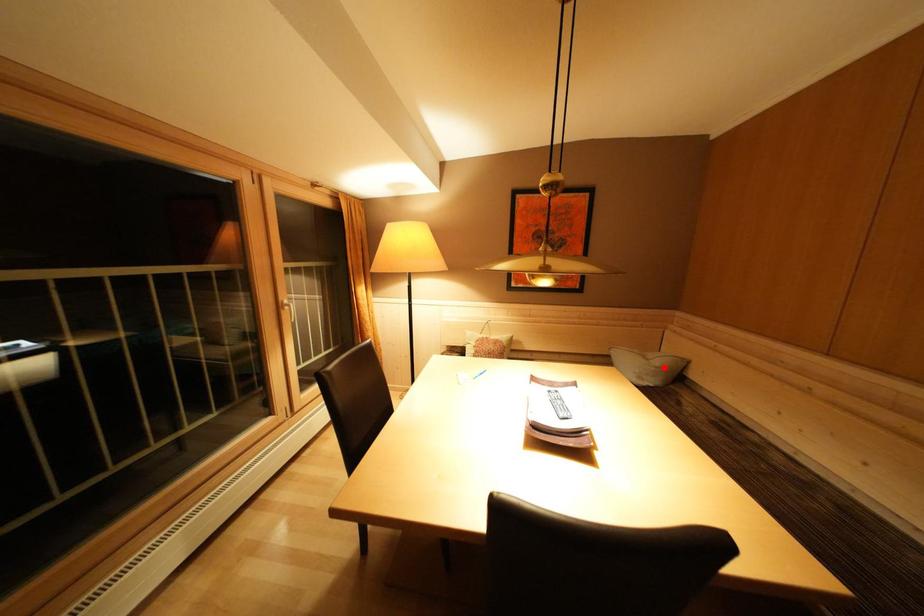
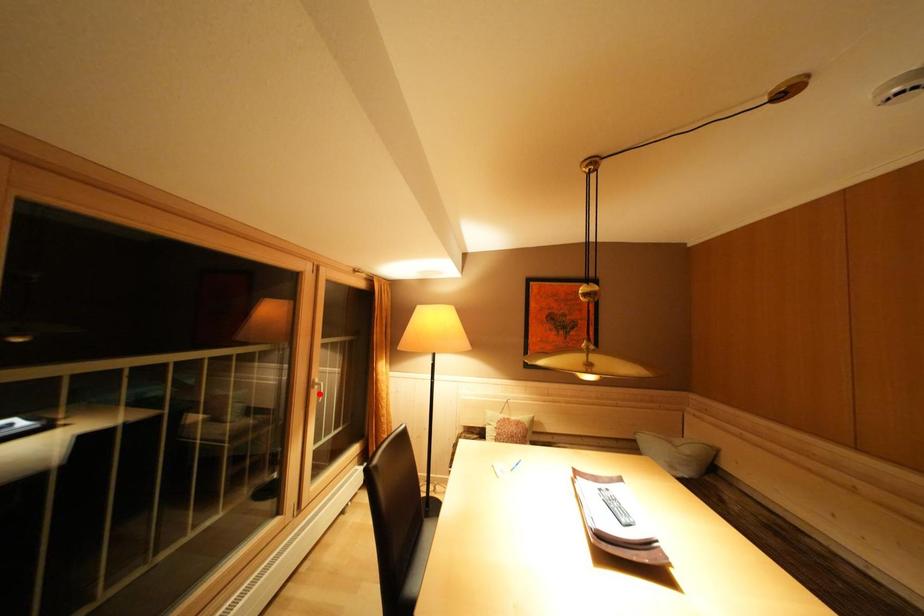
I am providing you with two images of the same scene from different viewpoints. A red point is marked on the first image and another point is marked on the second image. Is the red point in image1 aligned with the point shown in image2?

No